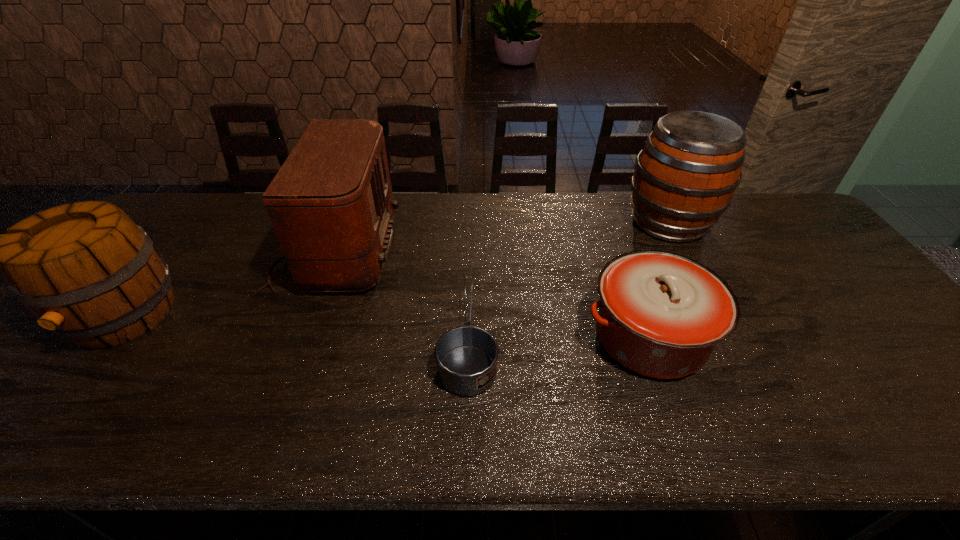
Where is `the taller cider`? The height and width of the screenshot is (540, 960). the taller cider is located at coordinates (685, 177).

Where is `the right cider`? This screenshot has width=960, height=540. the right cider is located at coordinates click(x=685, y=177).

Find the location of a particular element. The height and width of the screenshot is (540, 960). radio receiver is located at coordinates (331, 205).

At what (x,y) coordinates should I click in order to perform the action: click on the shorter cider. Please return your answer as a coordinate pair (x, y). This screenshot has width=960, height=540. Looking at the image, I should click on (86, 271).

This screenshot has height=540, width=960. Find the location of `the nearer cider`. the nearer cider is located at coordinates (86, 271).

This screenshot has width=960, height=540. In order to click on the fourth tallest object in this screenshot , I will do `click(661, 314)`.

Identify the location of the shortest object. (467, 356).

The width and height of the screenshot is (960, 540). I want to click on saucepan, so click(x=467, y=356).

Locate an element on the screen. The image size is (960, 540). free space located 0.190m on the front of the right cider is located at coordinates (708, 296).

Identify the location of free spot located on the front panel of the second object from left to right. (522, 250).